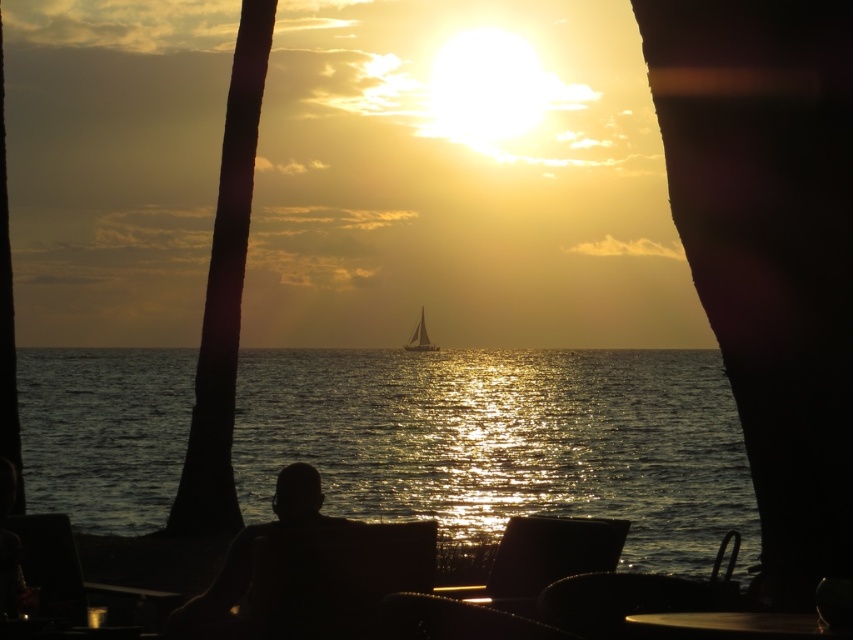
You are a photographer standing on the beach and want to capture both the silhouette wood palm tree at left and the silvery reflective sailboat at center in your photo. Which object will appear larger in the photo?

The silhouette wood palm tree at left will appear larger in the photo because it is closer to the viewer than the silvery reflective sailboat at center.

You are a photographer planning to take a photo of the black leather chair at center and the silvery reflective sailboat at center. Which object should you focus on first if you want to ensure both are in sharp focus?

The black leather chair at center is not as tall as the silvery reflective sailboat at center, so you should focus on the silvery reflective sailboat at center first to ensure both are in sharp focus.

You are an architect designing a new outdoor seating area. You want to place a black leather chair at center such that it aligns with the sailboat in the middle distance. Given the coordinates provided, can you determine the exact position to place the chair?

The black leather chair at center should be placed at the coordinates point (x=543, y=557) to align with the sailboat in the middle distance as per the provided 2D location.